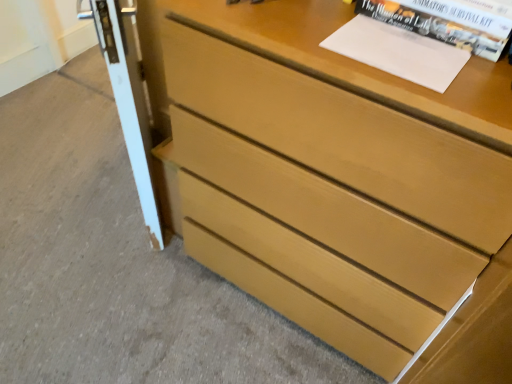
Identify the location of free space that is to the left of white glossy screen door at left. The height and width of the screenshot is (384, 512). (71, 170).